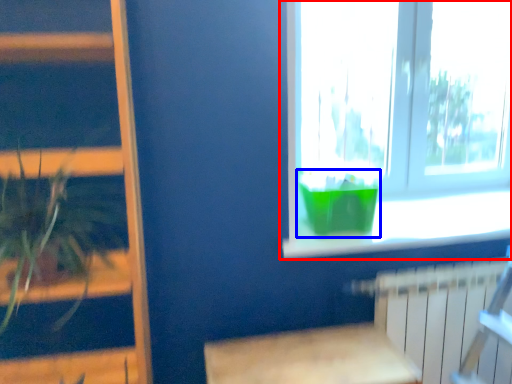
Question: Which object appears closest to the camera in this image, window (highlighted by a red box) or glass vase (highlighted by a blue box)?

Choices:
 (A) window
 (B) glass vase

Answer: (B)